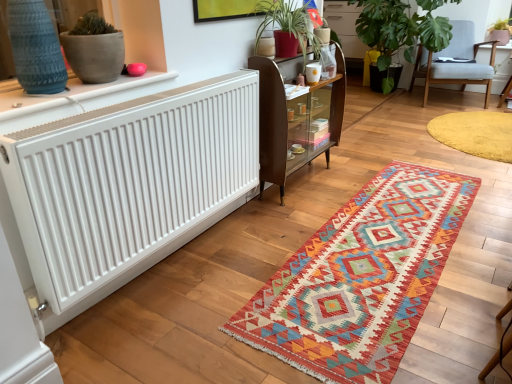
Identify the location of free area in between wooden glass-fronted cabinet at center and knitted woolen rug at center, the second mat when ordered from right to left. The height and width of the screenshot is (384, 512). (297, 216).